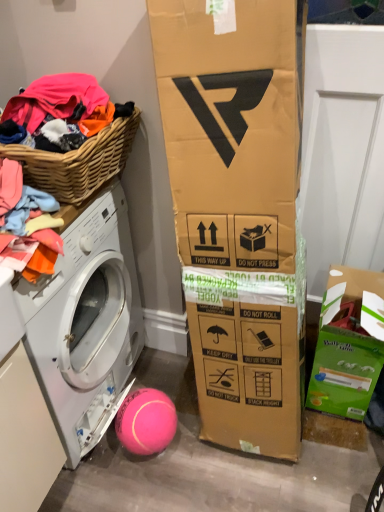
Question: Is pink rubber ball at lower center wider than woven wood basket at left?

Choices:
 (A) yes
 (B) no

Answer: (B)

Question: Is pink rubber ball at lower center placed right next to woven wood basket at left?

Choices:
 (A) no
 (B) yes

Answer: (A)

Question: Does pink rubber ball at lower center appear on the left side of woven wood basket at left?

Choices:
 (A) yes
 (B) no

Answer: (B)

Question: From a real-world perspective, is pink rubber ball at lower center beneath woven wood basket at left?

Choices:
 (A) yes
 (B) no

Answer: (A)

Question: Is pink rubber ball at lower center at the right side of woven wood basket at left?

Choices:
 (A) no
 (B) yes

Answer: (B)

Question: Is pink rubber ball at lower center outside woven wood basket at left?

Choices:
 (A) no
 (B) yes

Answer: (B)

Question: Can you confirm if green cardboard box at lower right is smaller than white glossy washing machine at left?

Choices:
 (A) no
 (B) yes

Answer: (B)

Question: Considering the relative positions of green cardboard box at lower right and white glossy washing machine at left in the image provided, is green cardboard box at lower right to the right of white glossy washing machine at left from the viewer's perspective?

Choices:
 (A) yes
 (B) no

Answer: (A)

Question: Is green cardboard box at lower right aimed at white glossy washing machine at left?

Choices:
 (A) yes
 (B) no

Answer: (B)

Question: Is the surface of green cardboard box at lower right in direct contact with white glossy washing machine at left?

Choices:
 (A) no
 (B) yes

Answer: (A)

Question: From a real-world perspective, is green cardboard box at lower right positioned under white glossy washing machine at left based on gravity?

Choices:
 (A) no
 (B) yes

Answer: (B)

Question: Can you confirm if green cardboard box at lower right is wider than white glossy washing machine at left?

Choices:
 (A) no
 (B) yes

Answer: (A)

Question: From the image's perspective, does pink rubber ball at lower center appear lower than green cardboard box at lower right?

Choices:
 (A) yes
 (B) no

Answer: (A)